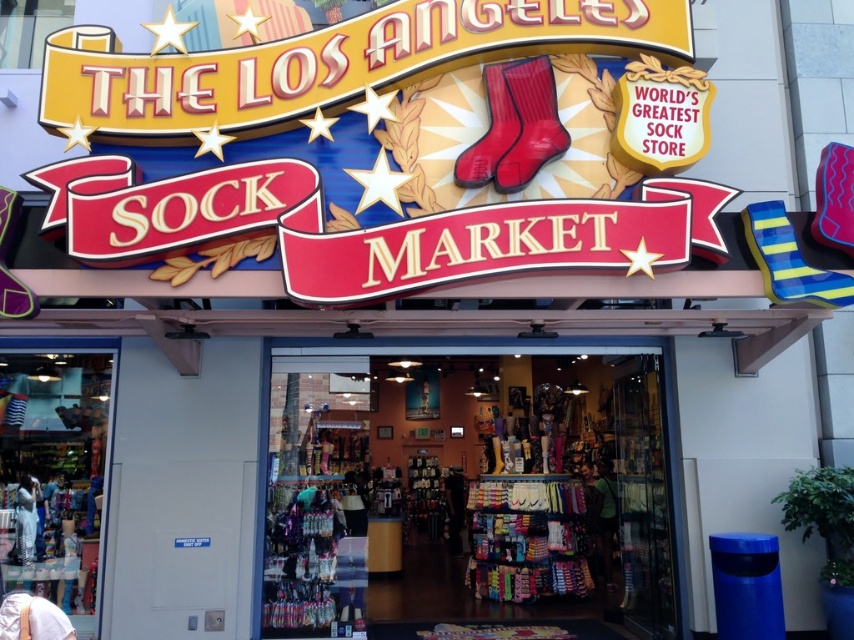
Question: Is the position of rubberized red boot at upper center more distant than that of rubberized matte red boot at upper center?

Choices:
 (A) yes
 (B) no

Answer: (A)

Question: Can you confirm if multicolored fabric socks at center is positioned to the left of matte white dress at lower left?

Choices:
 (A) yes
 (B) no

Answer: (B)

Question: Among these objects, which one is farthest from the camera?

Choices:
 (A) matte white dress at lower left
 (B) multicolored fabric socks at center
 (C) rubberized red boot at upper center

Answer: (B)

Question: Observing the image, what is the correct spatial positioning of multicolored fabric socks at center in reference to rubberized red boot at upper center?

Choices:
 (A) left
 (B) right

Answer: (B)

Question: Which point is farther to the camera?

Choices:
 (A) multicolored fabric socks at center
 (B) rubberized red boot at upper center
 (C) rubberized matte red boot at upper center

Answer: (A)

Question: Which object is positioned closest to the rubberized red boot at upper center?

Choices:
 (A) rubberized matte red boot at upper center
 (B) matte white dress at lower left

Answer: (A)